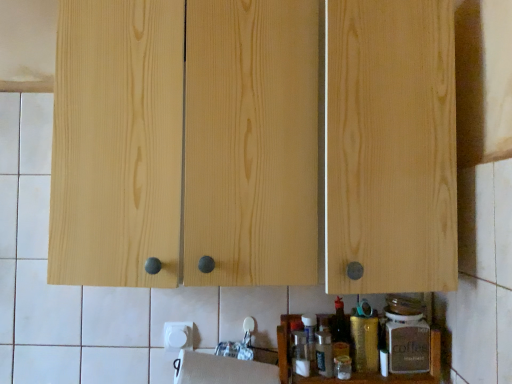
Question: Is wooden spice rack at lower center positioned before gold metallic canister at lower center, placed as the first bottle when sorted from left to right?

Choices:
 (A) no
 (B) yes

Answer: (B)

Question: Is wooden spice rack at lower center oriented towards gold metallic canister at lower center, placed as the first bottle when sorted from left to right?

Choices:
 (A) yes
 (B) no

Answer: (A)

Question: Is wooden spice rack at lower center located outside gold metallic canister at lower center, the 2th bottle viewed from the right?

Choices:
 (A) yes
 (B) no

Answer: (A)

Question: Is wooden spice rack at lower center further to camera compared to gold metallic canister at lower center, placed as the first bottle when sorted from left to right?

Choices:
 (A) no
 (B) yes

Answer: (A)

Question: Is wooden spice rack at lower center facing away from gold metallic canister at lower center, placed as the first bottle when sorted from left to right?

Choices:
 (A) yes
 (B) no

Answer: (A)

Question: Is matte brown glass coffee jar at lower right, which ranks as the 2th bottle in left-to-right order, wider or thinner than gold metallic canister at lower center, the 2th bottle viewed from the right?

Choices:
 (A) thin
 (B) wide

Answer: (A)

Question: From the image's perspective, relative to gold metallic canister at lower center, the 2th bottle viewed from the right, is matte brown glass coffee jar at lower right, which ranks as the 2th bottle in left-to-right order, above or below?

Choices:
 (A) above
 (B) below

Answer: (A)

Question: From a real-world perspective, is matte brown glass coffee jar at lower right, marked as the 1th bottle in a right-to-left arrangement, positioned above or below gold metallic canister at lower center, the 2th bottle viewed from the right?

Choices:
 (A) above
 (B) below

Answer: (A)

Question: Considering the positions of matte brown glass coffee jar at lower right, marked as the 1th bottle in a right-to-left arrangement, and gold metallic canister at lower center, placed as the first bottle when sorted from left to right, in the image, is matte brown glass coffee jar at lower right, marked as the 1th bottle in a right-to-left arrangement, bigger or smaller than gold metallic canister at lower center, placed as the first bottle when sorted from left to right,?

Choices:
 (A) small
 (B) big

Answer: (B)

Question: Choose the correct answer: Is wooden spice rack at lower center inside natural wood cabinet at center or outside it?

Choices:
 (A) inside
 (B) outside

Answer: (B)

Question: From a real-world perspective, relative to natural wood cabinet at center, is wooden spice rack at lower center vertically above or below?

Choices:
 (A) below
 (B) above

Answer: (A)

Question: Is wooden spice rack at lower center wider or thinner than natural wood cabinet at center?

Choices:
 (A) wide
 (B) thin

Answer: (B)

Question: From the image's perspective, is wooden spice rack at lower center located above or below natural wood cabinet at center?

Choices:
 (A) above
 (B) below

Answer: (B)

Question: From a real-world perspective, is natural wood cabinet at center above or below wooden spice rack at lower center?

Choices:
 (A) above
 (B) below

Answer: (A)

Question: Considering the positions of natural wood cabinet at center and wooden spice rack at lower center in the image, is natural wood cabinet at center wider or thinner than wooden spice rack at lower center?

Choices:
 (A) wide
 (B) thin

Answer: (A)